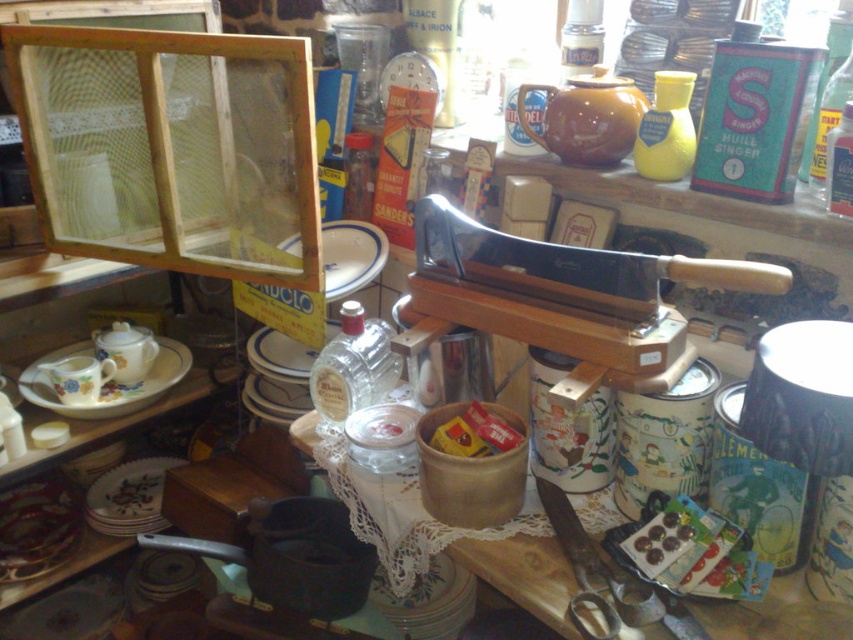
Is wooden cutting board at center shorter than white porcelain plate at center?

In fact, wooden cutting board at center may be taller than white porcelain plate at center.

Does wooden cutting board at center come in front of white porcelain plate at center?

Yes.

Locate an element on the screen. wooden cutting board at center is located at coordinates (519, 570).

Is point (560, 573) less distant than point (132, 404)?

That is True.

Which is in front, point (546, 550) or point (160, 372)?

Point (546, 550) is in front.

What do you see at coordinates (519, 570) in the screenshot? I see `wooden cutting board at center` at bounding box center [519, 570].

In order to click on wooden cutting board at center in this screenshot , I will do `click(519, 570)`.

Based on the photo, can you confirm if brown matte teapot at upper center is taller than white porcelain plate at center?

Yes.

Is point (607, 124) farther from viewer compared to point (368, 264)?

No, it is not.

Where is `brown matte teapot at upper center`? brown matte teapot at upper center is located at coordinates (585, 116).